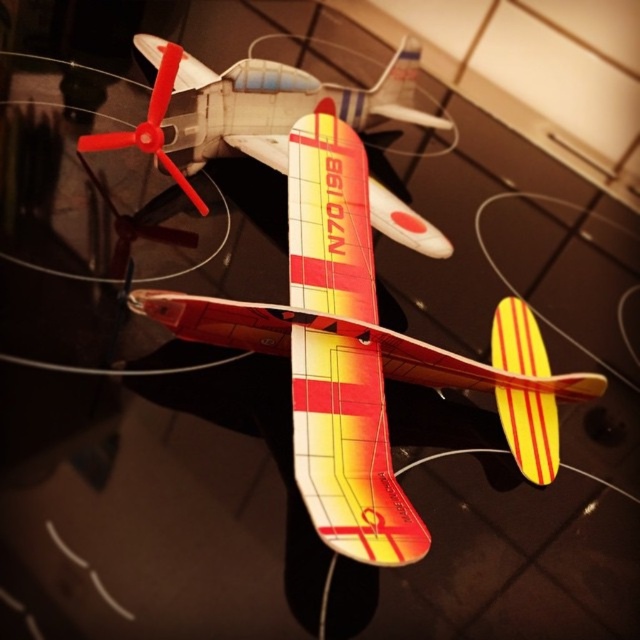
You are an aviation enthusiast examining two model airplanes on a glass table. You notice the matte plastic airplane at center and the red plastic propeller at center. Which object has a greater width?

The matte plastic airplane at center has a greater width than the red plastic propeller at center, as stated in the description that the matte plastic airplane at center surpasses the red plastic propeller at center in width.

You are an aviation enthusiast inspecting the model airplanes. You notice the shiny red airplane at center and the red plastic propeller at center. Which object is closer to you?

The shiny red airplane at center is closer to you because it is positioned over the red plastic propeller at center, indicating it is in front.

You are an aviation enthusiast examining two model airplanes on a glass table. You notice the shiny red airplane at center and the red plastic propeller at center. Which object is located to the right of the other?

The shiny red airplane at center is positioned on the right side of the red plastic propeller at center, so the shiny red airplane at center is to the right of the red plastic propeller at center.